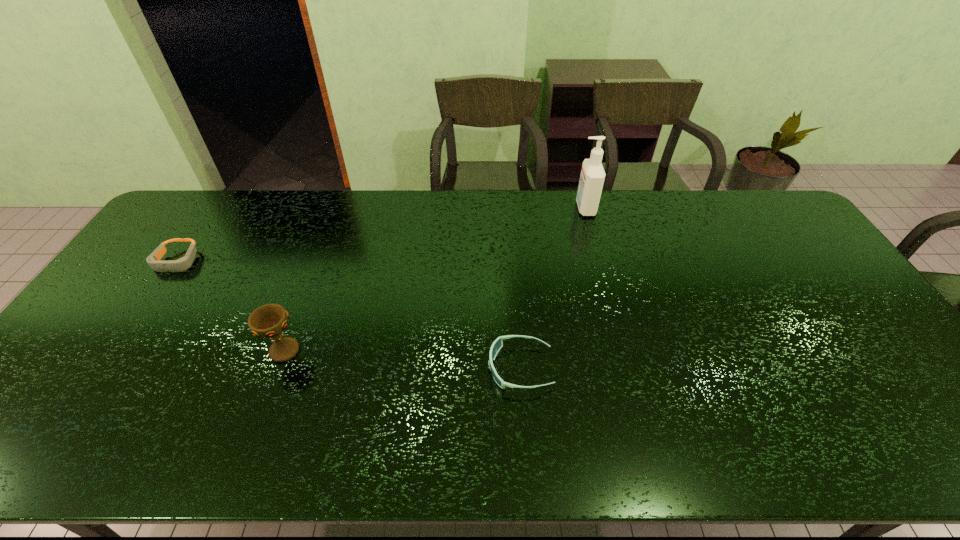
The height and width of the screenshot is (540, 960). Find the location of `the rightmost object`. the rightmost object is located at coordinates (592, 177).

Identify the location of the farthest object. This screenshot has height=540, width=960. (592, 177).

Locate an element on the screen. the second tallest object is located at coordinates (268, 321).

Where is `the third object from right to left`? the third object from right to left is located at coordinates (268, 321).

At what (x,y) coordinates should I click in order to perform the action: click on the third tallest object. Please return your answer as a coordinate pair (x, y). The width and height of the screenshot is (960, 540). Looking at the image, I should click on (498, 343).

You are a GUI agent. You are given a task and a screenshot of the screen. Output one action in this format:
    pyautogui.click(x=<x>, y=<y>)
    Task: Click on the second object from right to left
    
    Given the screenshot: What is the action you would take?
    click(498, 343)

Where is `the shortest object`? This screenshot has width=960, height=540. the shortest object is located at coordinates (154, 260).

Identify the location of the farther goggles. This screenshot has height=540, width=960. click(x=154, y=260).

I want to click on free space located on the front label of the rightmost object, so click(524, 208).

The height and width of the screenshot is (540, 960). Find the location of `blank space located on the front label of the rightmost object`. blank space located on the front label of the rightmost object is located at coordinates (521, 208).